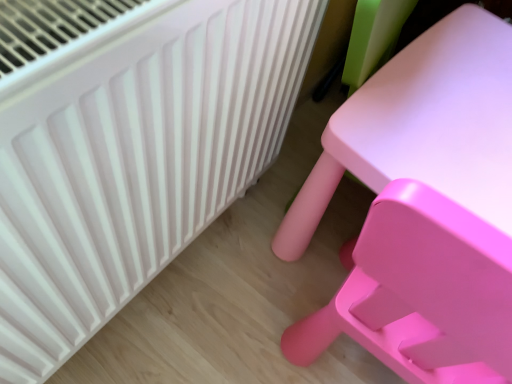
Question: Is white plastic radiator at upper left spatially inside matte plastic table at right, or outside of it?

Choices:
 (A) outside
 (B) inside

Answer: (A)

Question: From the image's perspective, relative to matte plastic table at right, is white plastic radiator at upper left above or below?

Choices:
 (A) above
 (B) below

Answer: (B)

Question: Considering the relative positions of white plastic radiator at upper left and matte plastic table at right in the image provided, is white plastic radiator at upper left to the left or to the right of matte plastic table at right?

Choices:
 (A) right
 (B) left

Answer: (B)

Question: In terms of width, does matte plastic table at right look wider or thinner when compared to white plastic radiator at upper left?

Choices:
 (A) thin
 (B) wide

Answer: (A)

Question: Is matte plastic table at right situated inside white plastic radiator at upper left or outside?

Choices:
 (A) outside
 (B) inside

Answer: (A)

Question: Considering their positions, is matte plastic table at right located in front of or behind white plastic radiator at upper left?

Choices:
 (A) front
 (B) behind

Answer: (A)

Question: Considering the positions of matte plastic table at right and white plastic radiator at upper left in the image, is matte plastic table at right bigger or smaller than white plastic radiator at upper left?

Choices:
 (A) small
 (B) big

Answer: (B)